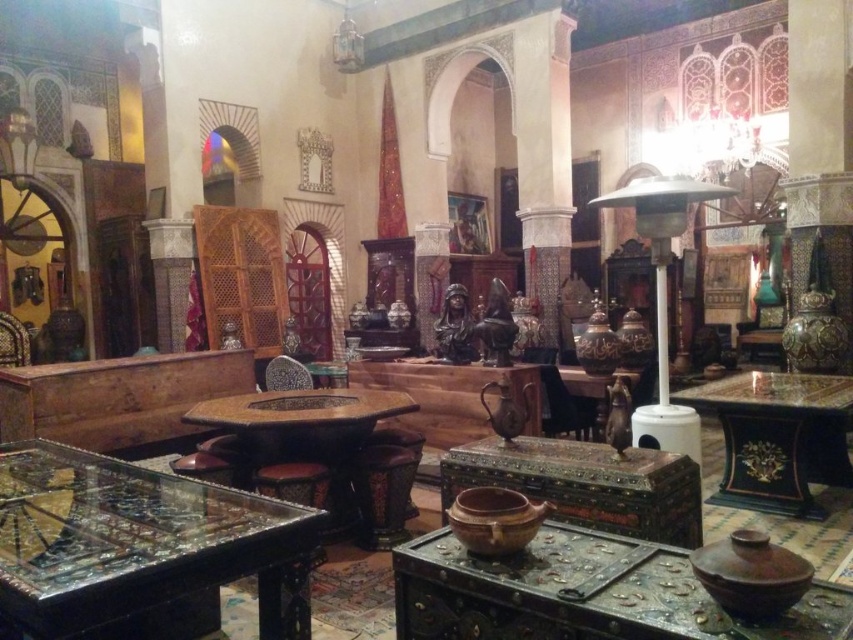
Question: Which object is farther from the camera taking this photo?

Choices:
 (A) black leather chair at center
 (B) brown matte pot at lower right
 (C) transparent glass table at lower left

Answer: (A)

Question: Is brown leather chest at lower center further to camera compared to brown earthenware pot at center?

Choices:
 (A) no
 (B) yes

Answer: (A)

Question: Does brown earthenware pot at center appear over wooden chest at center?

Choices:
 (A) yes
 (B) no

Answer: (B)

Question: Which point is farther to the camera?

Choices:
 (A) wooden chair at center
 (B) brown matte pot at lower right
 (C) wooden table at center

Answer: (A)

Question: Does brown matte pot at lower right appear under wooden chest at center?

Choices:
 (A) yes
 (B) no

Answer: (A)

Question: Which point appears farthest from the camera in this image?

Choices:
 (A) (550, 426)
 (B) (740, 577)
 (C) (450, 513)

Answer: (A)